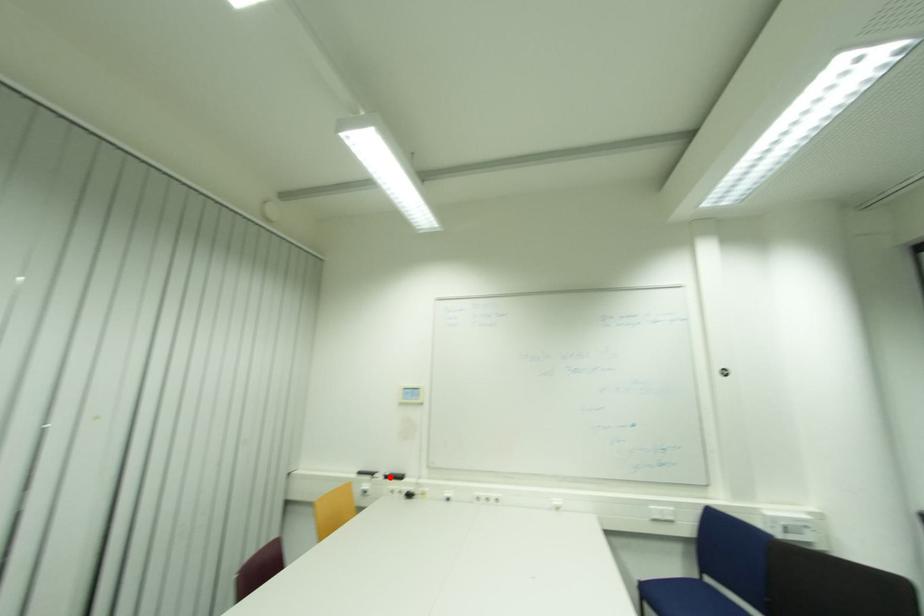
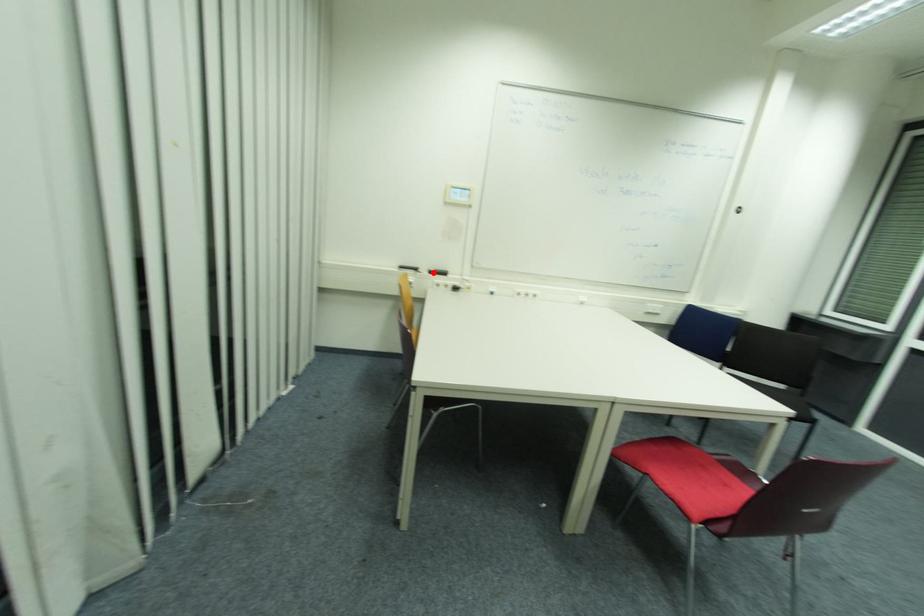
I am providing you with two images of the same scene from different viewpoints. A red point is marked on the first image and another point is marked on the second image. Does the point marked in image1 correspond to the same location as the one in image2?

Yes